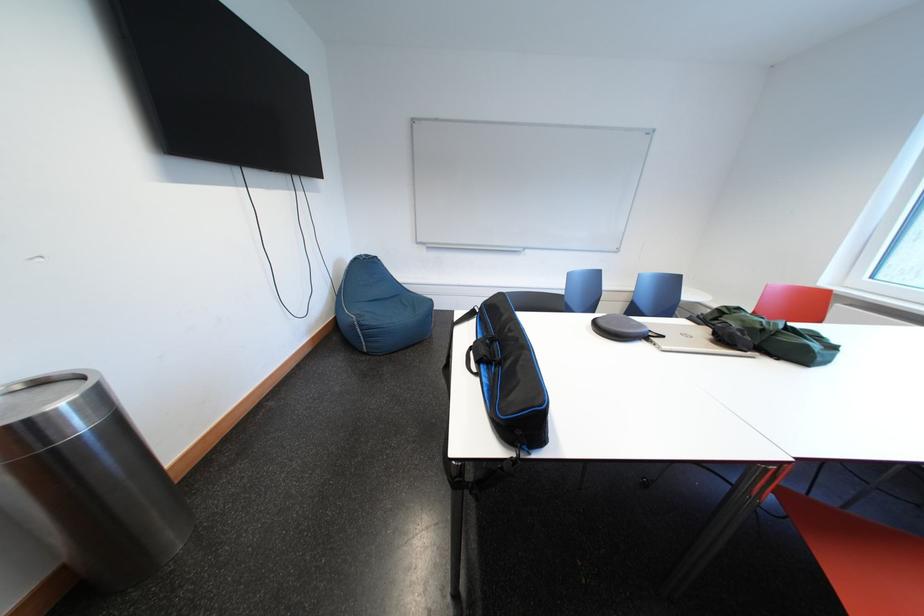
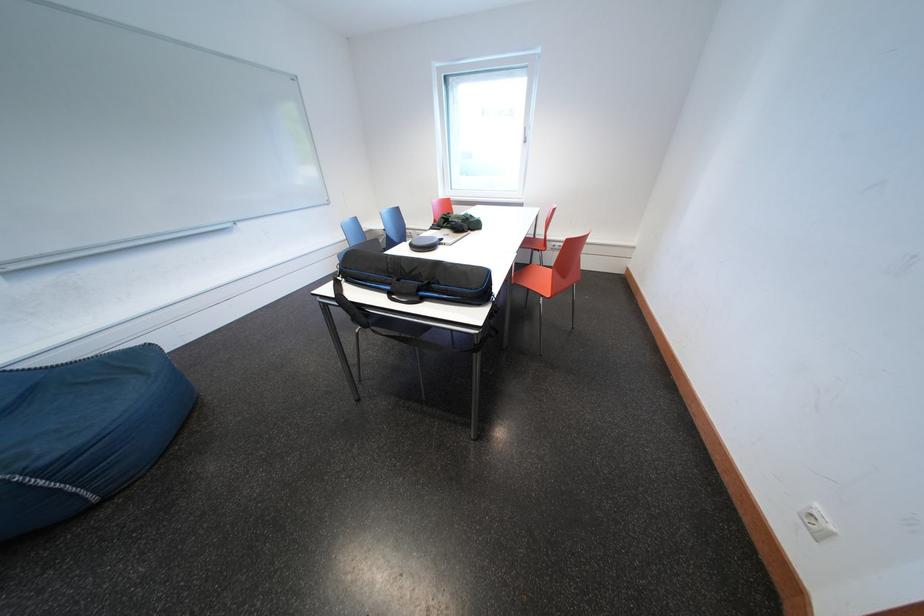
Find the pixel in the second image that matches pixel 370 330 in the first image.

(46, 477)